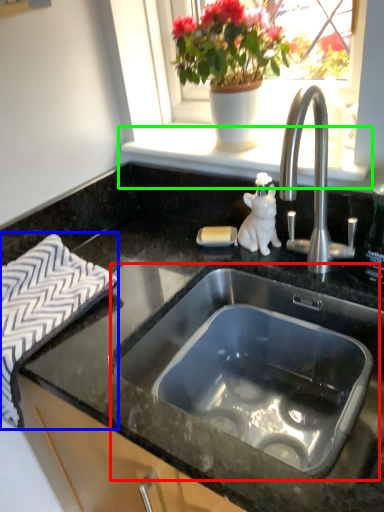
Question: Considering the real-world distances, which object is farthest from sink (highlighted by a red box)? bath towel (highlighted by a blue box) or window sill (highlighted by a green box)?

Choices:
 (A) bath towel
 (B) window sill

Answer: (B)